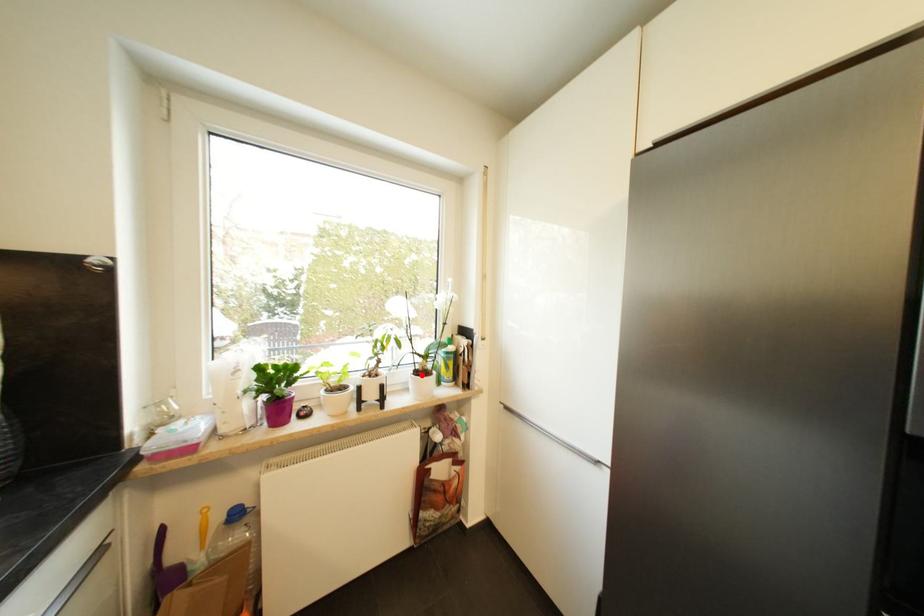
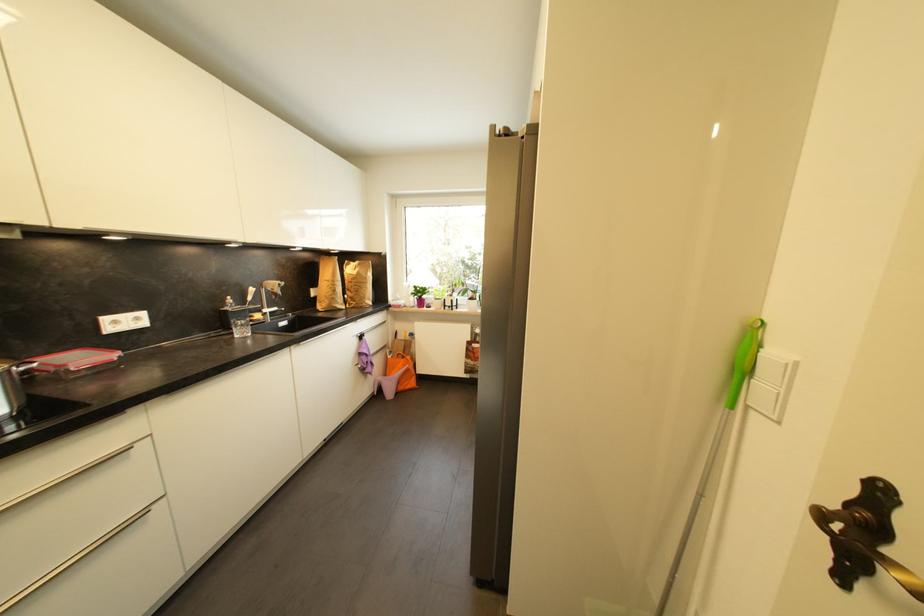
The point at the highlighted location is marked in the first image. Where is the corresponding point in the second image?

(475, 301)